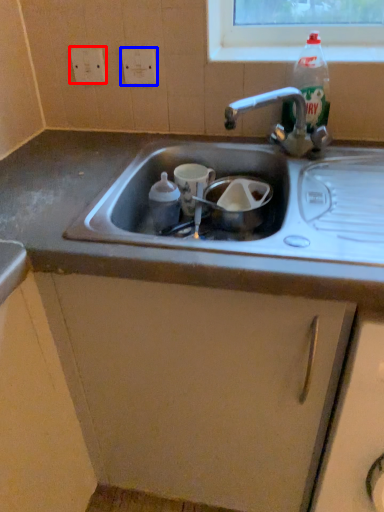
Question: Which object is closer to the camera taking this photo, electric outlet (highlighted by a red box) or electric outlet (highlighted by a blue box)?

Choices:
 (A) electric outlet
 (B) electric outlet

Answer: (B)